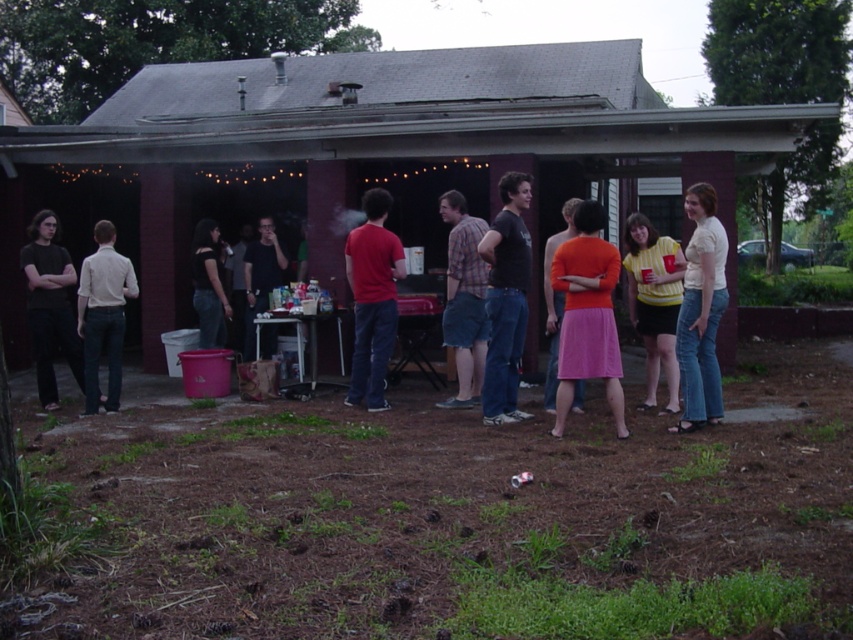
You are at a party in the backyard and want to hand a drink to the person wearing the orange fabric skirt at center and the orange matte dress at center. Since you can only reach a certain distance, which one can you reach first without moving your position?

The orange fabric skirt at center is closer to the viewer than the orange matte dress at center, so you can reach the person wearing the orange fabric skirt at center first.

You are organizing a game that requires players to stand exactly 12 feet apart. You see two people wearing the plaid fabric shirt at center and the light beige shirt at left. Can they participate in the game as they are currently positioned?

The plaid fabric shirt at center and light beige shirt at left are 10.96 feet apart, which is less than the required 12 feet. Therefore, they cannot participate in the game as they are currently positioned.